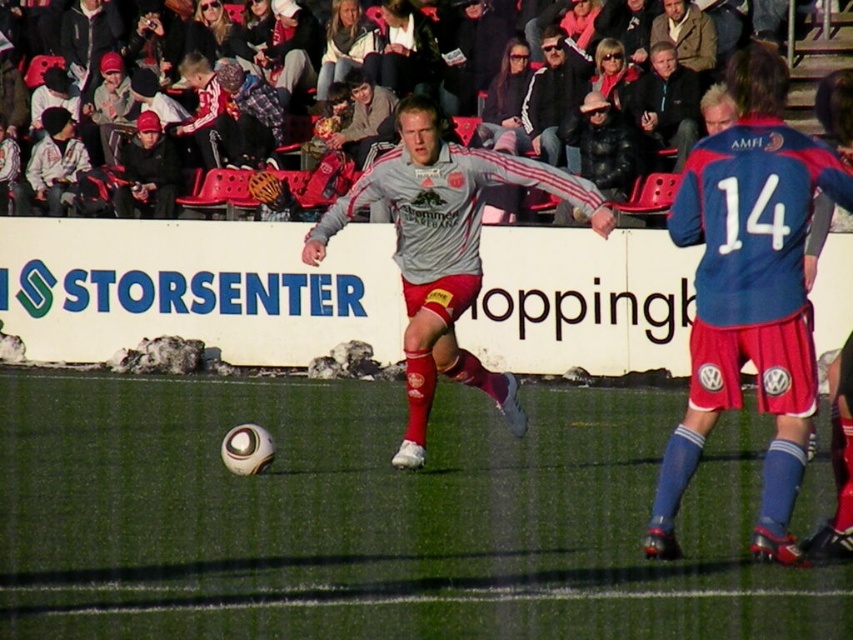
Question: Estimate the real-world distances between objects in this image. Which object is farther from the matte black jacket at left?

Choices:
 (A) matte gray jersey at center
 (B) blue jersey at right
 (C) green artificial turf at center

Answer: (B)

Question: Which object is the closest to the green artificial turf at center?

Choices:
 (A) dark blue jacket at upper center
 (B) matte black jacket at left
 (C) white cotton hoodie at upper left

Answer: (A)

Question: Can you confirm if matte gray jersey at center is wider than white cotton hoodie at upper left?

Choices:
 (A) no
 (B) yes

Answer: (B)

Question: Does matte black jacket at left appear on the left side of white cotton hoodie at upper left?

Choices:
 (A) yes
 (B) no

Answer: (B)

Question: Which object appears closest to the camera in this image?

Choices:
 (A) matte black jacket at left
 (B) matte gray jersey at center
 (C) white cotton hoodie at upper left

Answer: (B)

Question: Is matte gray jersey at center wider than dark blue jacket at upper center?

Choices:
 (A) no
 (B) yes

Answer: (B)